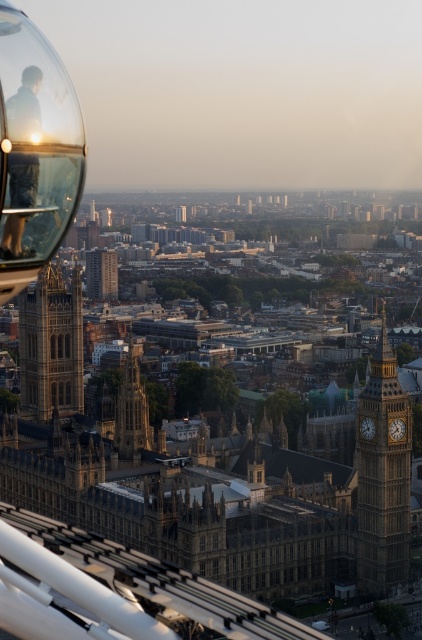
Between golden stone clock tower at right and brown stone tower at center, which one has less height?

With less height is brown stone tower at center.

Does golden stone clock tower at right have a smaller size compared to brown stone tower at center?

Correct, golden stone clock tower at right occupies less space than brown stone tower at center.

Between point (370, 410) and point (137, 374), which one is positioned behind?

Positioned behind is point (137, 374).

Find the location of a particular element. golden stone clock tower at right is located at coordinates (383, 476).

Does golden stone tower at center-left have a smaller size compared to matte black jacket at upper left?

No.

Can you confirm if golden stone tower at center-left is positioned below matte black jacket at upper left?

Indeed, golden stone tower at center-left is positioned under matte black jacket at upper left.

Is point (35, 285) positioned after point (18, 200)?

Yes, it is behind point (18, 200).

At what (x,y) coordinates should I click in order to perform the action: click on golden stone tower at center-left. Please return your answer as a coordinate pair (x, y). The height and width of the screenshot is (640, 422). Looking at the image, I should click on (51, 346).

Which is below, golden stone clock tower at right or golden stone tower at center-left?

golden stone clock tower at right

Is golden stone clock tower at right positioned at the back of golden stone tower at center-left?

Yes, it is behind golden stone tower at center-left.

Does point (368, 588) come farther from viewer compared to point (40, 400)?

That is False.

The width and height of the screenshot is (422, 640). In order to click on golden stone clock tower at right in this screenshot , I will do `click(383, 476)`.